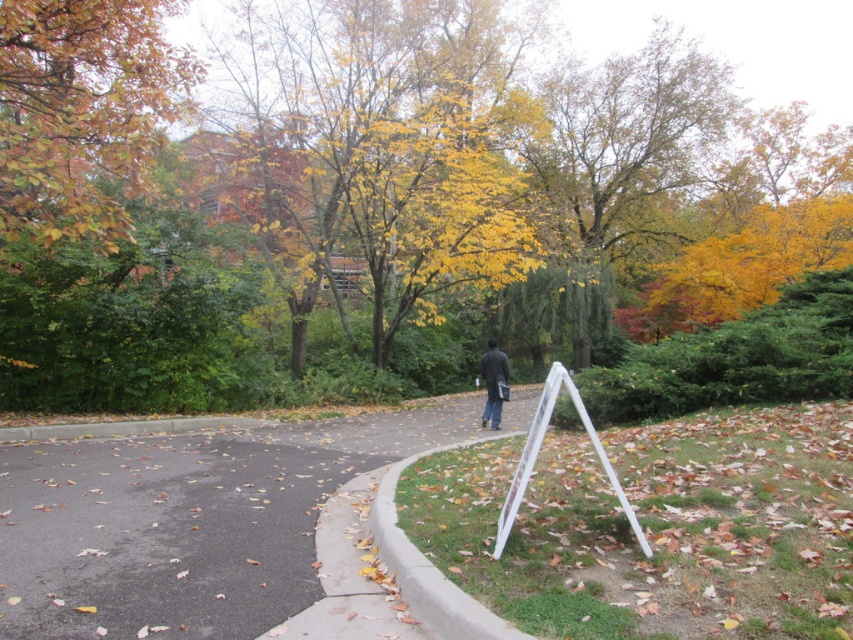
Question: Does asphalt road at center have a larger size compared to autumn leaves at upper left?

Choices:
 (A) yes
 (B) no

Answer: (A)

Question: Which of the following is the farthest from the observer?

Choices:
 (A) (155, 113)
 (B) (103, 493)

Answer: (A)

Question: Is asphalt road at center in front of dark gray jacket at center?

Choices:
 (A) yes
 (B) no

Answer: (A)

Question: Which object is farther from the camera taking this photo?

Choices:
 (A) autumn leaves at upper left
 (B) dark gray jacket at center
 (C) asphalt road at center

Answer: (B)

Question: From the image, what is the correct spatial relationship of asphalt road at center in relation to dark gray jacket at center?

Choices:
 (A) above
 (B) below

Answer: (B)

Question: Which is farther from the asphalt road at center?

Choices:
 (A) autumn leaves at upper left
 (B) dark gray jacket at center

Answer: (A)